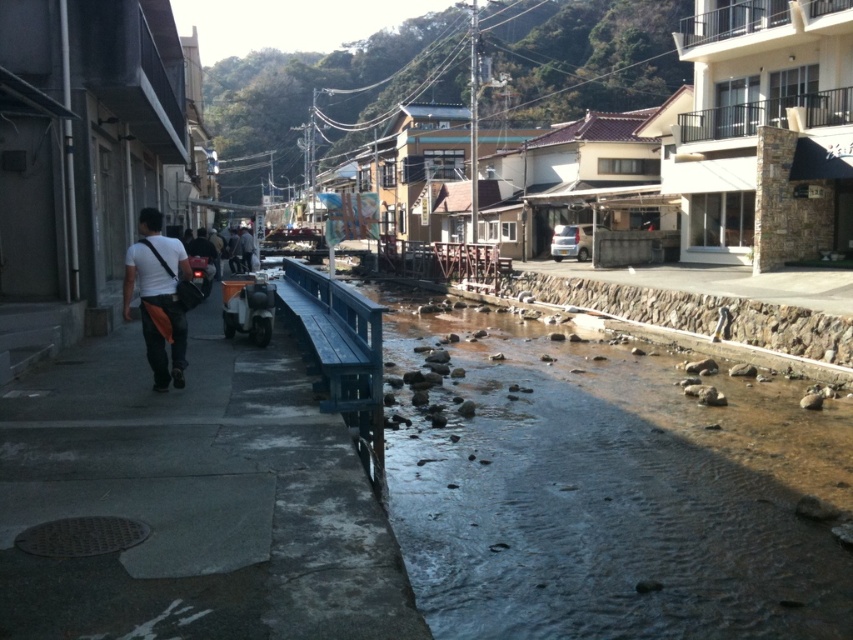
You are a delivery person needing to cross the stream shown in the image. The clear water at center is part of the stream. Considering the size of the dark gray fabric jacket at center, do you think the jacket can be used to cross the stream without getting wet?

The clear water at center has a smaller size compared to dark gray fabric jacket at center. Since the jacket is larger than the water area, it could potentially be used to cover or bridge the stream, but the description does not provide information about the jacket material or practicality for such use. However, based on size alone, the jacket might physically cover the water area.

Consider the image. You are a delivery person needing to cross the stream. The clear water at center and the concrete sidewalk at left are both options. Which path is wider and safer for carrying heavy items?

The clear water at center is wider than the concrete sidewalk at left, making it a safer path for carrying heavy items since it provides more space.